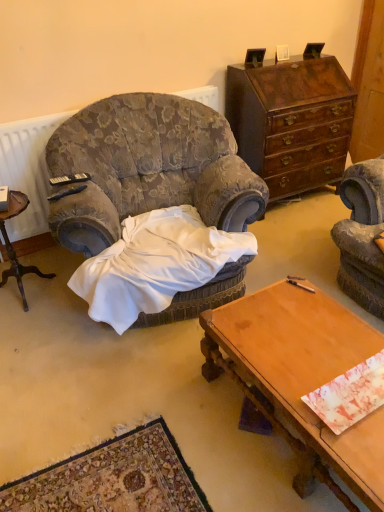
This screenshot has height=512, width=384. Identify the location of vacant region to the left of marbled paper at center. (283, 371).